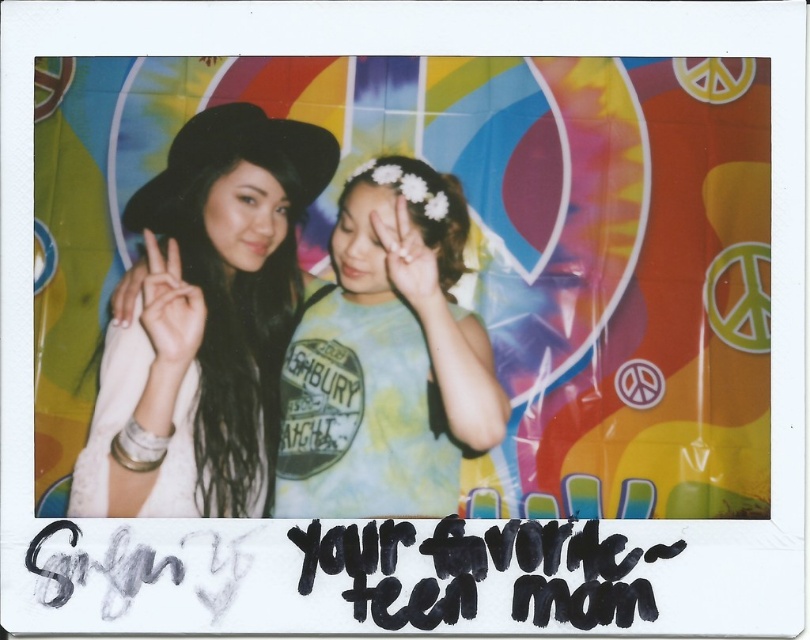
Is tie-dye fabric shirt at center bigger than matte black hand at center?

Yes, tie-dye fabric shirt at center is bigger than matte black hand at center.

Measure the distance between tie-dye fabric shirt at center and camera.

tie-dye fabric shirt at center is 78.42 centimeters from camera.

Find the location of `tie-dye fabric shirt at center`. tie-dye fabric shirt at center is located at coordinates (386, 358).

Can you confirm if matte black hat at left is positioned to the left of tie-dye fabric shirt at center?

Correct, you'll find matte black hat at left to the left of tie-dye fabric shirt at center.

Between point (288, 326) and point (293, 460), which one is positioned in front?

Point (293, 460)

Locate an element on the screen. The height and width of the screenshot is (640, 810). matte black hat at left is located at coordinates (203, 323).

At what (x,y) coordinates should I click in order to perform the action: click on matte black hat at left. Please return your answer as a coordinate pair (x, y). The height and width of the screenshot is (640, 810). Looking at the image, I should click on click(203, 323).

What do you see at coordinates (203, 323) in the screenshot?
I see `matte black hat at left` at bounding box center [203, 323].

I want to click on matte black hat at left, so click(x=203, y=323).